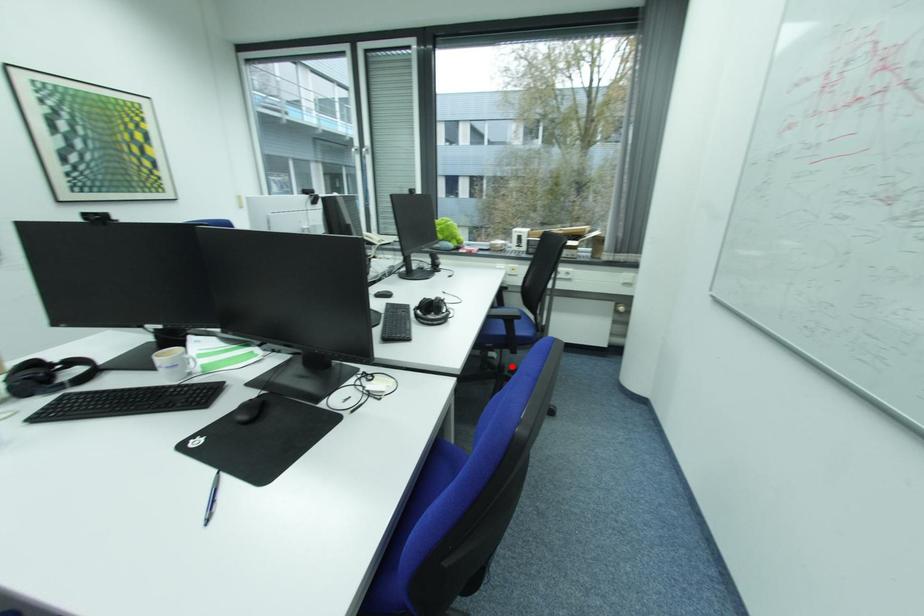
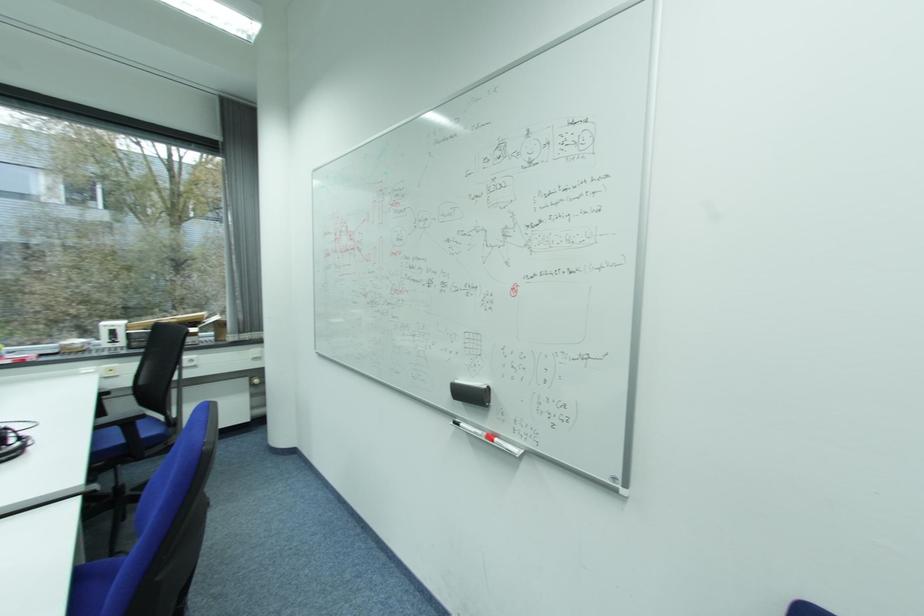
Find the pixel in the second image that matches the highlighted location in the first image.

(131, 487)